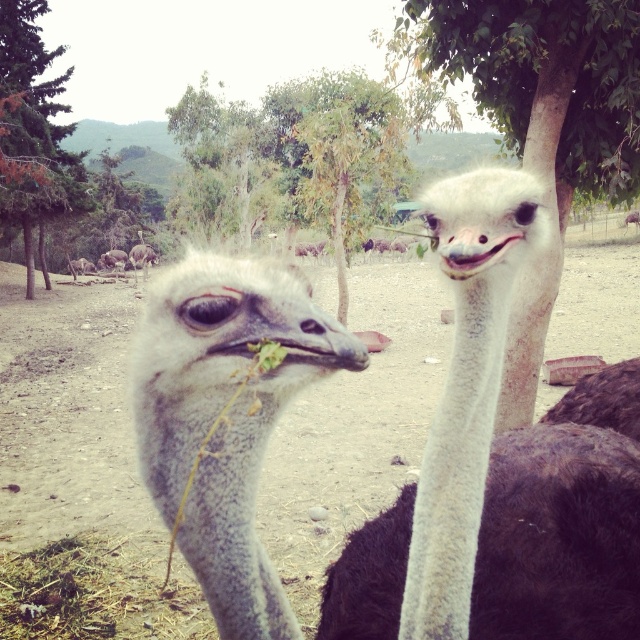
Question: Which object is farther from the camera taking this photo?

Choices:
 (A) green leafy tree at upper center
 (B) gray feathered ostrich at center

Answer: (A)

Question: Is green leafy tree at upper center below green leafy tree at upper left?

Choices:
 (A) yes
 (B) no

Answer: (A)

Question: Which of the following is the closest to the observer?

Choices:
 (A) white fuzzy neck at center
 (B) green leafy tree at upper center
 (C) white feathered ostrich at center

Answer: (C)

Question: Does gray feathered ostrich at center lie in front of white fuzzy neck at center?

Choices:
 (A) no
 (B) yes

Answer: (B)

Question: Which of these objects is positioned closest to the white fuzzy neck at center?

Choices:
 (A) green leafy tree at upper center
 (B) green leafy tree at upper left
 (C) gray feathered ostrich at center
 (D) white feathered ostrich at center

Answer: (D)

Question: Observing the image, what is the correct spatial positioning of green leafy tree at upper center in reference to green leafy tree at upper left?

Choices:
 (A) below
 (B) above

Answer: (A)